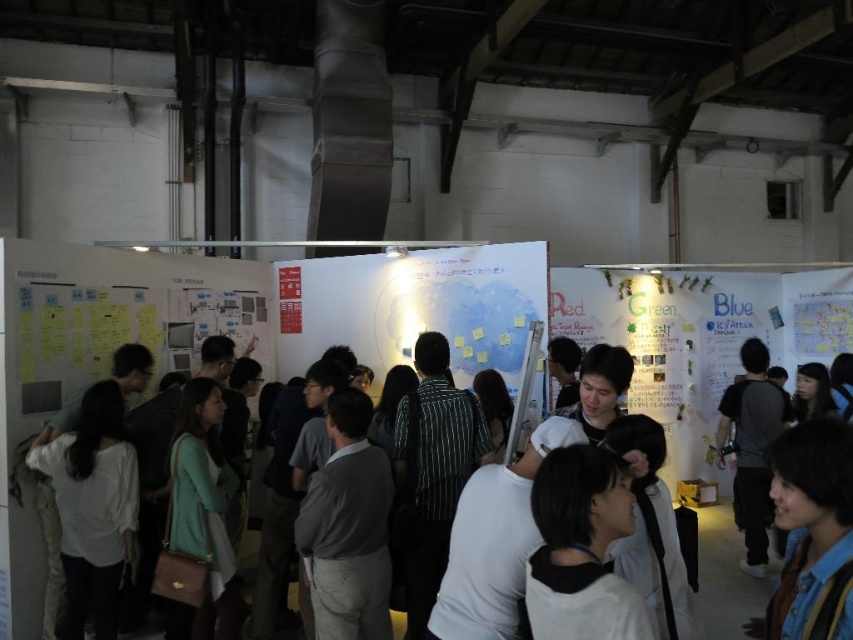
Question: Does white matte poster at center appear on the left side of green matte poster at center?

Choices:
 (A) yes
 (B) no

Answer: (A)

Question: Does white matte poster at center have a larger size compared to white matte shirt at center?

Choices:
 (A) no
 (B) yes

Answer: (B)

Question: Which point is farther from the camera taking this photo?

Choices:
 (A) (292, 316)
 (B) (721, 614)

Answer: (A)

Question: Which point is farther to the camera?

Choices:
 (A) (517, 328)
 (B) (747, 595)
 (C) (641, 346)

Answer: (C)

Question: Does white matte poster at center have a greater width compared to green matte poster at center?

Choices:
 (A) no
 (B) yes

Answer: (A)

Question: Which point appears farthest from the camera in this image?

Choices:
 (A) pos(277,285)
 (B) pos(648,275)
 (C) pos(740,618)

Answer: (B)